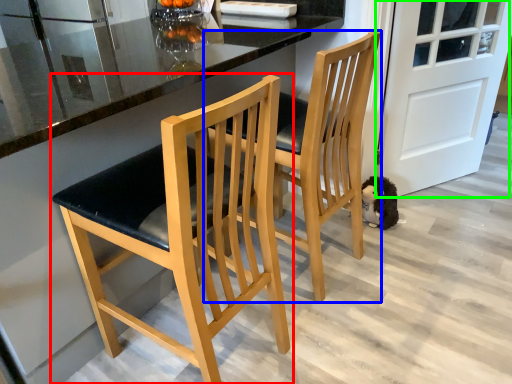
Question: Considering the real-world distances, which object is closest to chair (highlighted by a red box)? chair (highlighted by a blue box) or door (highlighted by a green box).

Choices:
 (A) chair
 (B) door

Answer: (A)